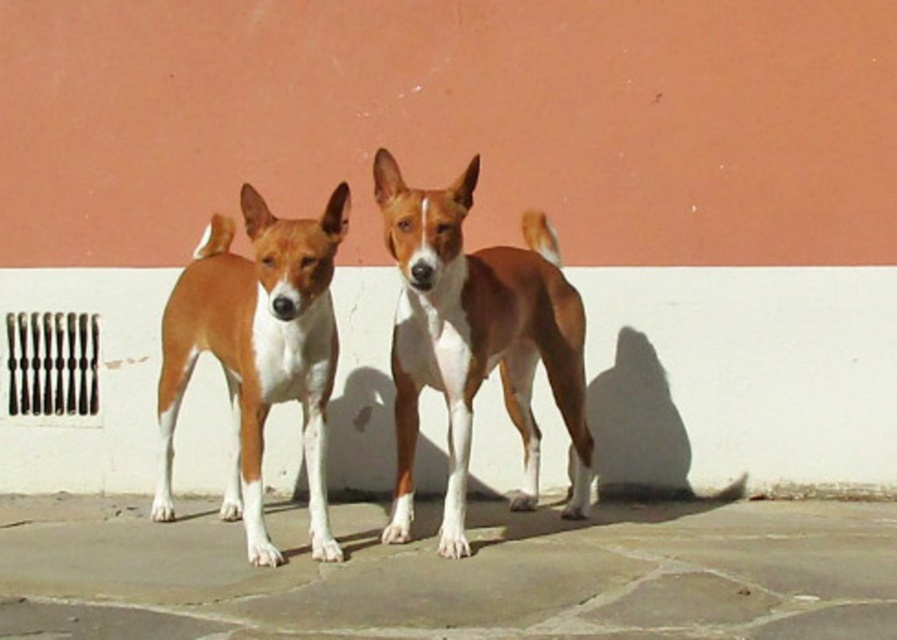
Question: Does gray stone pavement at center come in front of brown and white fur dog at center?

Choices:
 (A) no
 (B) yes

Answer: (B)

Question: Is gray stone pavement at center positioned before brown furry dog at center?

Choices:
 (A) yes
 (B) no

Answer: (A)

Question: Among these objects, which one is farthest from the camera?

Choices:
 (A) gray stone pavement at center
 (B) brown and white fur dog at center

Answer: (B)

Question: Which point appears farthest from the camera in this image?

Choices:
 (A) (163, 513)
 (B) (405, 616)
 (C) (431, 244)

Answer: (A)

Question: Does brown furry dog at center appear on the left side of brown and white fur dog at center?

Choices:
 (A) no
 (B) yes

Answer: (A)

Question: Which point is farther to the camera?

Choices:
 (A) gray stone pavement at center
 (B) brown and white fur dog at center
 (C) brown furry dog at center

Answer: (C)